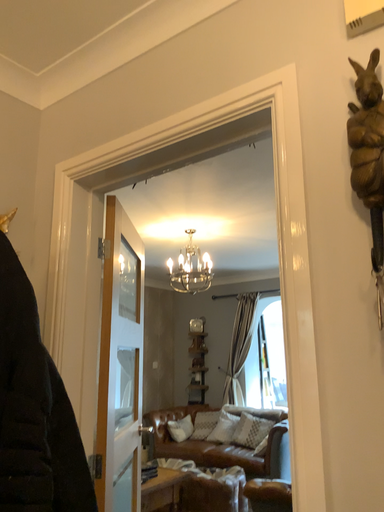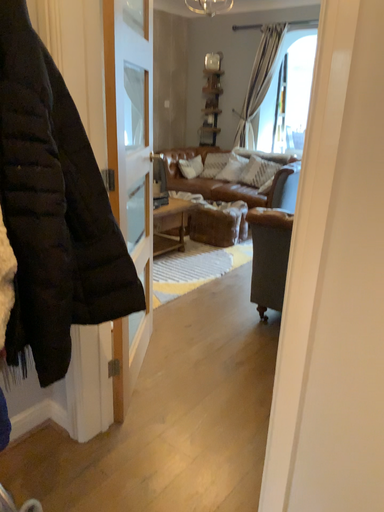
Question: Which way did the camera rotate in the video?

Choices:
 (A) rotated downward
 (B) rotated upward

Answer: (A)